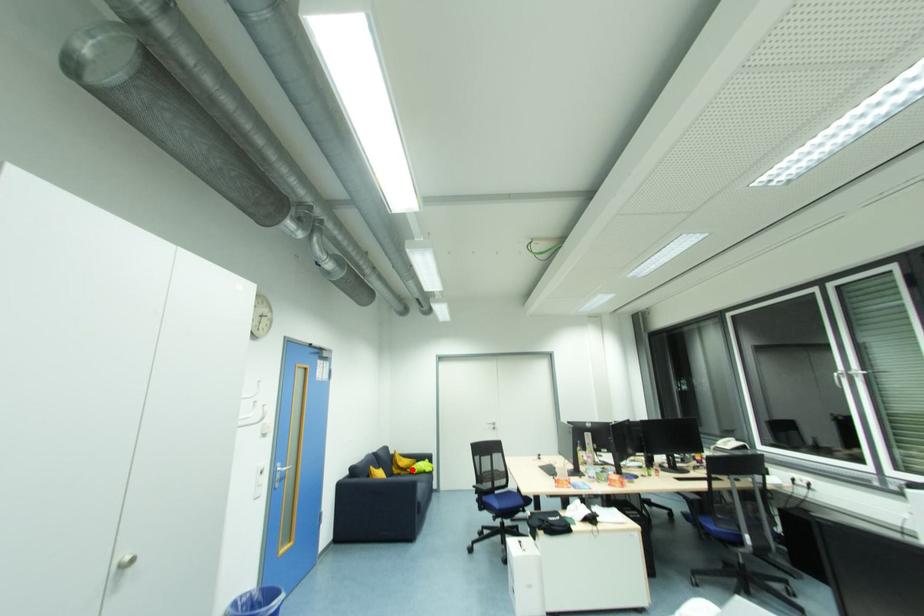
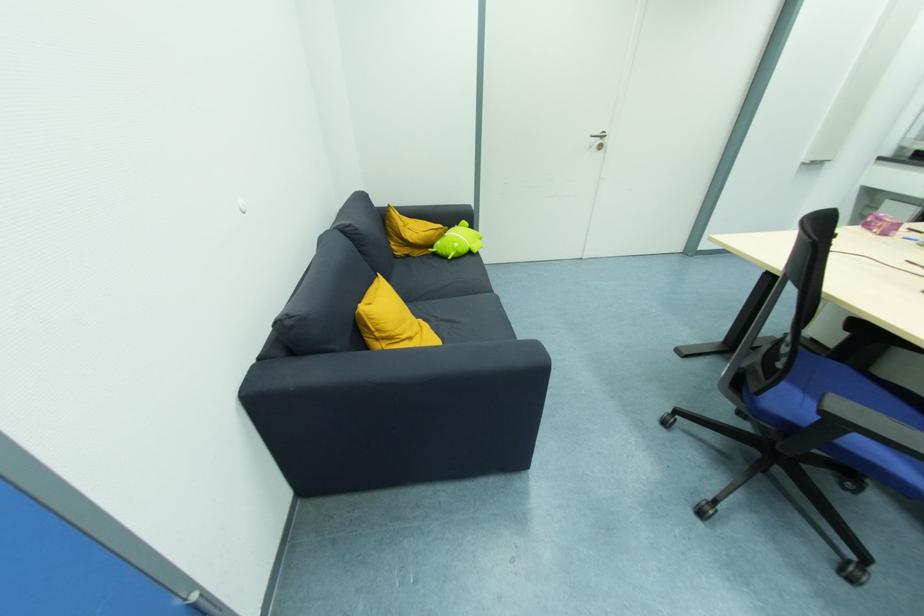
Question: I am providing you with two images of the same scene from different viewpoints. Image1 has a red point marked. In image2, the corresponding 3D location appears at what relative position? Reply with the corresponding letter.

Choices:
 (A) Closer
 (B) Farther

Answer: (A)